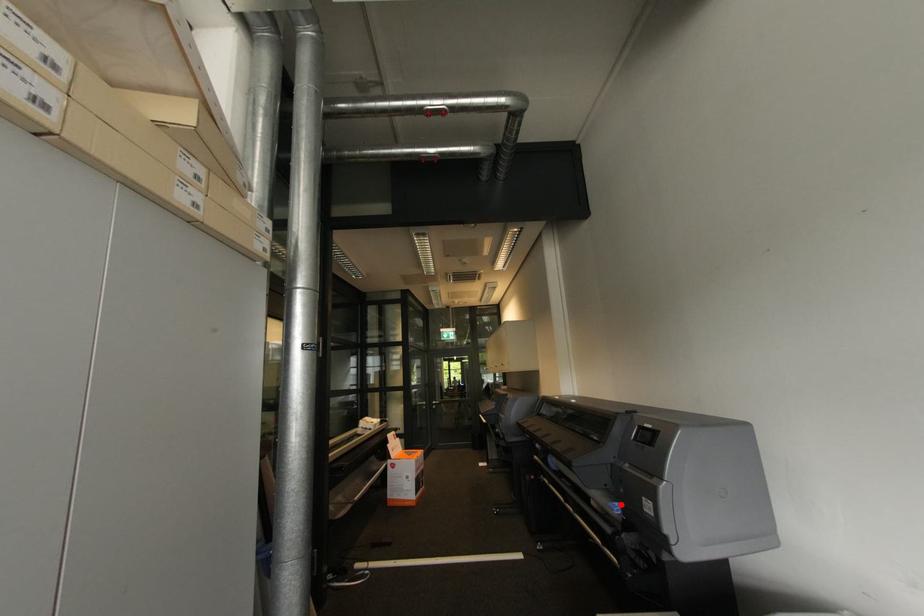
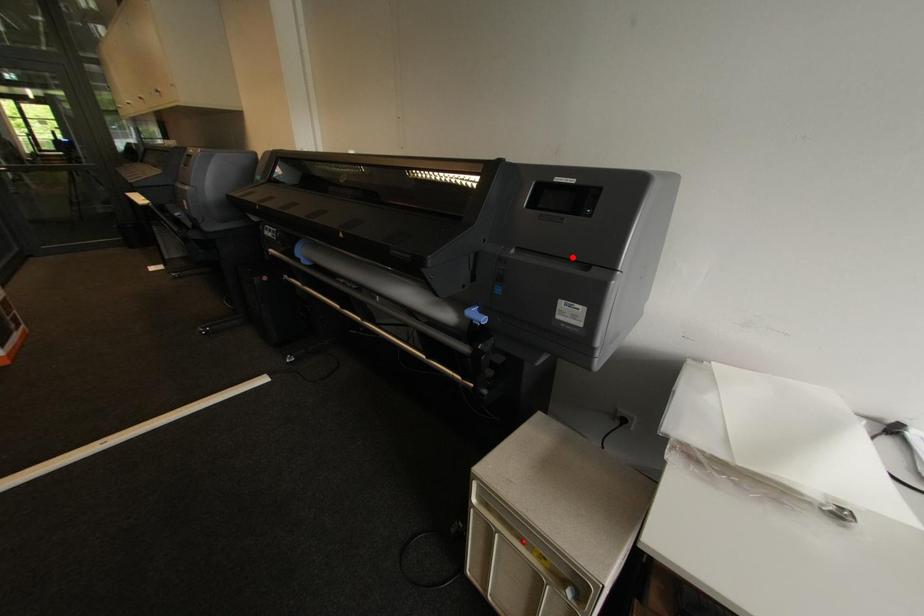
I am providing you with two images of the same scene from different viewpoints. A red point is marked on the first image and another point is marked on the second image. Is the marked point in image1 the same physical position as the marked point in image2?

No